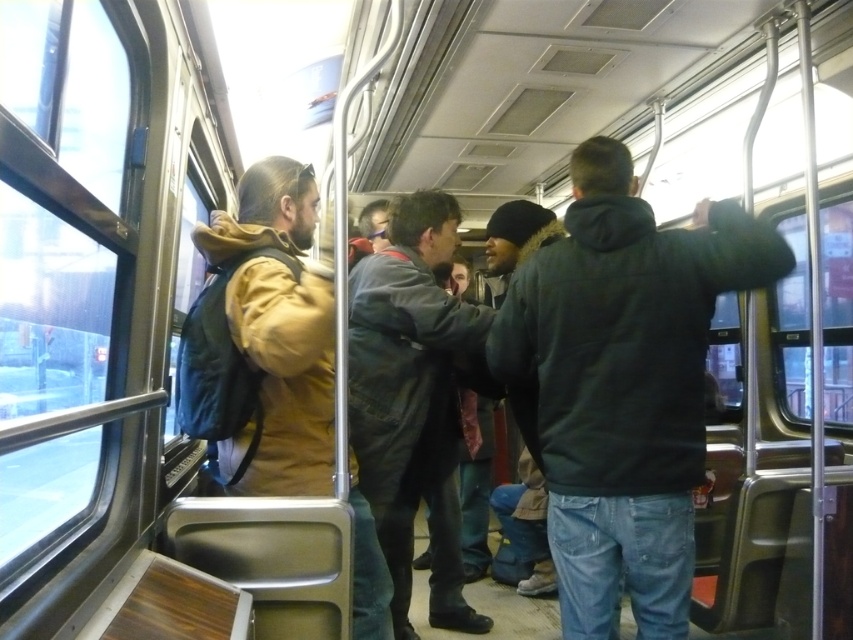
Measure the distance from dark gray leather jacket at center to dark gray jacket at center.

A distance of 36.90 inches exists between dark gray leather jacket at center and dark gray jacket at center.

Who is higher up, dark gray leather jacket at center or dark gray jacket at center?

dark gray leather jacket at center is above.

The height and width of the screenshot is (640, 853). Describe the element at coordinates (413, 397) in the screenshot. I see `dark gray leather jacket at center` at that location.

The width and height of the screenshot is (853, 640). I want to click on dark gray leather jacket at center, so click(x=413, y=397).

Between point (311, 387) and point (468, 467), which one is positioned behind?

Positioned behind is point (468, 467).

Does brown leather jacket at left appear on the left side of dark gray jacket at center?

Correct, you'll find brown leather jacket at left to the left of dark gray jacket at center.

Is point (310, 381) closer to viewer compared to point (485, 452)?

Yes.

Find the location of a particular element. This screenshot has height=640, width=853. brown leather jacket at left is located at coordinates (265, 339).

Does dark gray hoodie at right lie behind dark gray leather jacket at center?

No, it is in front of dark gray leather jacket at center.

Is dark gray hoodie at right thinner than dark gray leather jacket at center?

No.

Measure the distance between dark gray hoodie at right and camera.

The distance of dark gray hoodie at right from camera is 1.77 meters.

Where is `dark gray hoodie at right`? dark gray hoodie at right is located at coordinates (624, 385).